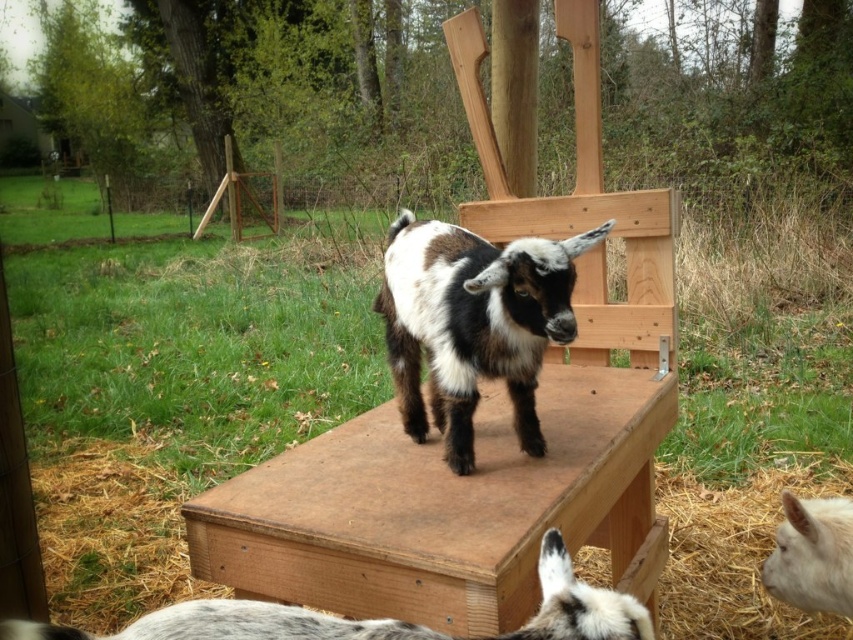
Does white speckled fur goat at lower center have a lesser height compared to white woolen goat at lower right?

Yes, white speckled fur goat at lower center is shorter than white woolen goat at lower right.

Is white speckled fur goat at lower center behind white woolen goat at lower right?

That is False.

Which is in front, point (190, 628) or point (798, 540)?

Point (190, 628) is more forward.

This screenshot has height=640, width=853. Find the location of `white speckled fur goat at lower center`. white speckled fur goat at lower center is located at coordinates (376, 618).

Does straw at lower right appear over white woolen goat at lower right?

No, straw at lower right is not above white woolen goat at lower right.

Does straw at lower right appear on the right side of white woolen goat at lower right?

Indeed, straw at lower right is positioned on the right side of white woolen goat at lower right.

The height and width of the screenshot is (640, 853). What do you see at coordinates (735, 554) in the screenshot? I see `straw at lower right` at bounding box center [735, 554].

I want to click on straw at lower right, so click(x=735, y=554).

Is straw at lower right above white speckled fur goat at lower center?

No, straw at lower right is not above white speckled fur goat at lower center.

Is point (679, 572) positioned in front of point (552, 632)?

That is False.

At what (x,y) coordinates should I click in order to perform the action: click on straw at lower right. Please return your answer as a coordinate pair (x, y). This screenshot has height=640, width=853. Looking at the image, I should click on (735, 554).

At what (x,y) coordinates should I click in order to perform the action: click on straw at lower right. Please return your answer as a coordinate pair (x, y). This screenshot has width=853, height=640. Looking at the image, I should click on (735, 554).